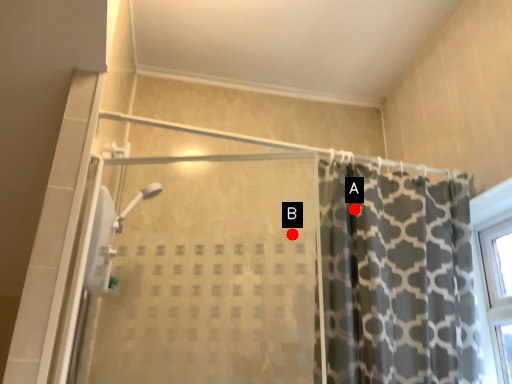
Question: Two points are circled on the image, labeled by A and B beside each circle. Among these points, which one is farthest from the camera?

Choices:
 (A) A is further
 (B) B is further

Answer: (B)